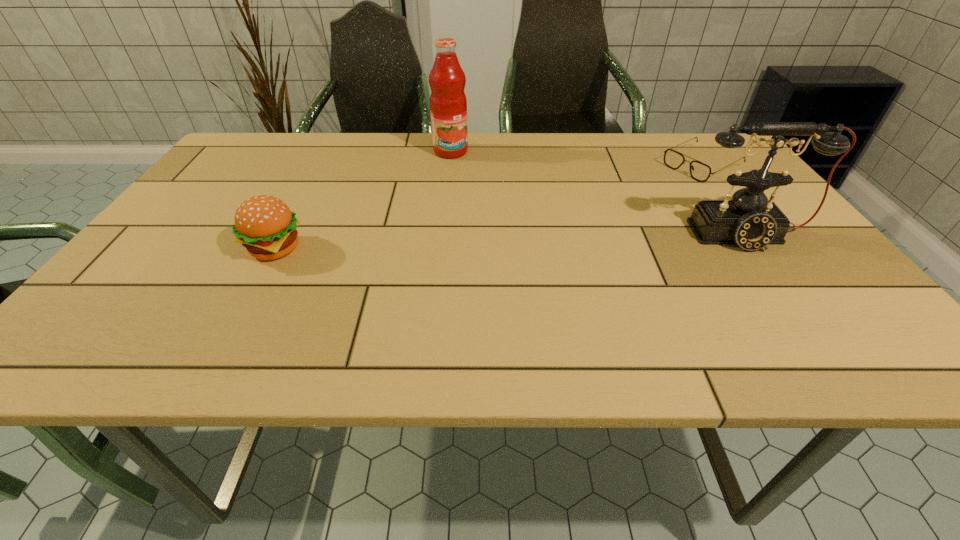
The image size is (960, 540). In order to click on free space on the desktop that is between the hamburger and the telephone and is positioned on the front label of the third object from right to left in this screenshot , I will do `click(531, 241)`.

Identify the location of vacant space on the desktop that is between the third tallest object and the third shortest object and is positioned on the front-facing side of the shortest object. coord(550,241).